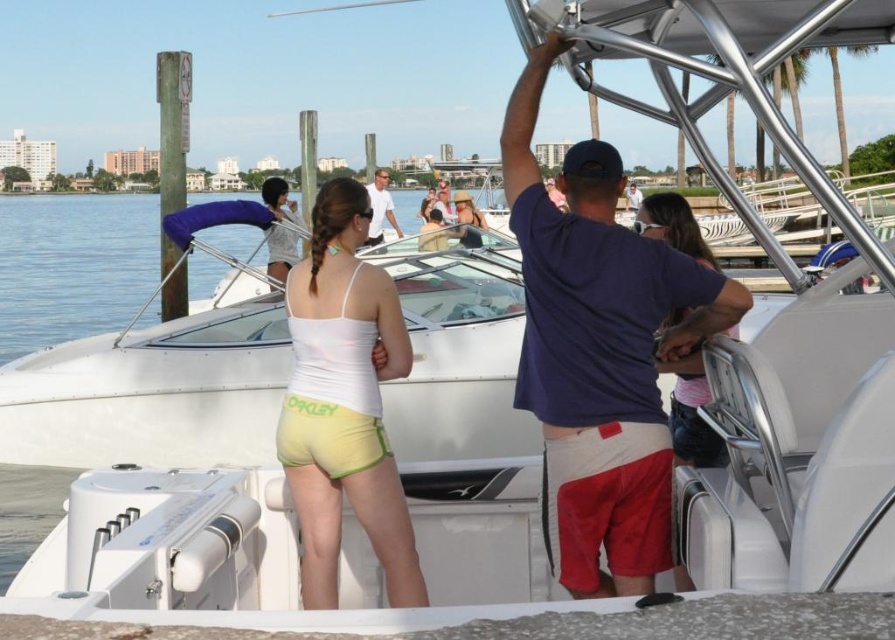
Is point (373, 532) closer to camera compared to point (381, 170)?

Yes, point (373, 532) is in front of point (381, 170).

Locate an element on the screen. The image size is (895, 640). white matte tank top at center is located at coordinates (344, 403).

Identify the location of white matte tank top at center. (344, 403).

This screenshot has width=895, height=640. In order to click on white matte tank top at center in this screenshot , I will do `click(344, 403)`.

Is pink fabric shirt at center to the left of white shirt at center from the viewer's perspective?

No, pink fabric shirt at center is not to the left of white shirt at center.

Based on the photo, who is more forward, (663, 221) or (374, 198)?

Point (663, 221) is in front.

Does point (684, 237) come farther from viewer compared to point (376, 173)?

No, (684, 237) is in front of (376, 173).

I want to click on pink fabric shirt at center, so click(691, 413).

Which is more to the left, matte white blouse at center or matte yellow bikini top at center?

matte white blouse at center is more to the left.

Is matte white blouse at center to the left of matte yellow bikini top at center from the viewer's perspective?

Indeed, matte white blouse at center is positioned on the left side of matte yellow bikini top at center.

Is point (283, 268) positioned before point (476, 243)?

No, (283, 268) is further to viewer.

Locate an element on the screen. matte white blouse at center is located at coordinates (280, 252).